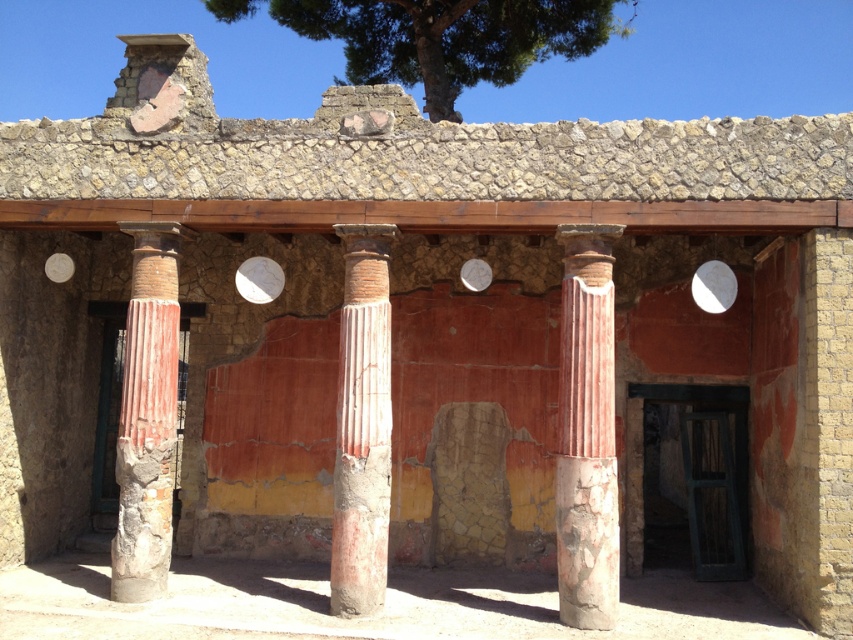
Question: Estimate the real-world distances between objects in this image. Which object is farther from the red marble column at center?

Choices:
 (A) green leafy tree at upper center
 (B) reddish-brown stone column at left
 (C) smooth terracotta column at center

Answer: (A)

Question: Among these objects, which one is farthest from the camera?

Choices:
 (A) reddish-brown stone column at left
 (B) red marble column at center
 (C) smooth terracotta column at center
 (D) green leafy tree at upper center

Answer: (D)

Question: Which point is closer to the camera taking this photo?

Choices:
 (A) (141, 307)
 (B) (488, 45)
 (C) (610, 333)

Answer: (C)

Question: Does smooth terracotta column at center lie in front of reddish-brown stone column at left?

Choices:
 (A) yes
 (B) no

Answer: (A)

Question: Is red marble column at center to the right of reddish-brown stone column at left from the viewer's perspective?

Choices:
 (A) yes
 (B) no

Answer: (A)

Question: Does green leafy tree at upper center appear under red marble column at center?

Choices:
 (A) yes
 (B) no

Answer: (B)